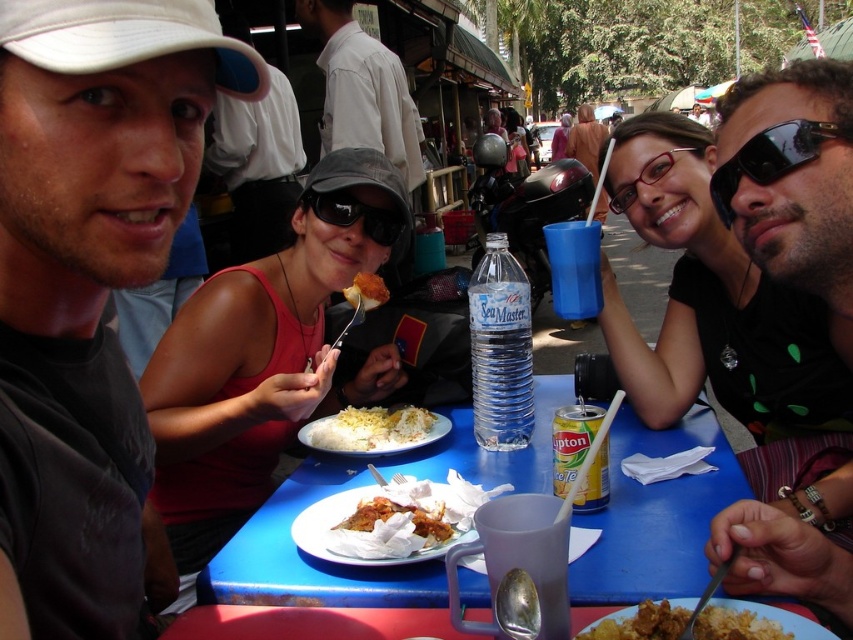
Who is positioned more to the left, dark green dotted shirt at right or white paper plate at center?

Positioned to the left is white paper plate at center.

Is point (733, 115) in front of point (355, 518)?

Yes, it is.

Is point (850, 227) closer to camera compared to point (320, 557)?

Yes, point (850, 227) is in front of point (320, 557).

In order to click on dark green dotted shirt at right in this screenshot , I will do `click(792, 180)`.

Does dark green dotted shirt at right have a larger size compared to yellow rice at plate right?

Yes, dark green dotted shirt at right is bigger than yellow rice at plate right.

Is dark green dotted shirt at right thinner than yellow rice at plate right?

Incorrect, dark green dotted shirt at right's width is not less than yellow rice at plate right's.

Describe the element at coordinates (792, 180) in the screenshot. I see `dark green dotted shirt at right` at that location.

The image size is (853, 640). I want to click on dark green dotted shirt at right, so click(x=792, y=180).

Can you confirm if matte black sunglasses at upper center is smaller than yellow rice at plate right?

No, matte black sunglasses at upper center is not smaller than yellow rice at plate right.

Is matte black sunglasses at upper center to the right of yellow rice at plate right from the viewer's perspective?

Incorrect, matte black sunglasses at upper center is not on the right side of yellow rice at plate right.

Is point (259, 193) farther from viewer compared to point (711, 620)?

Yes, point (259, 193) is farther from viewer.

Locate an element on the screen. The image size is (853, 640). matte black sunglasses at upper center is located at coordinates (258, 164).